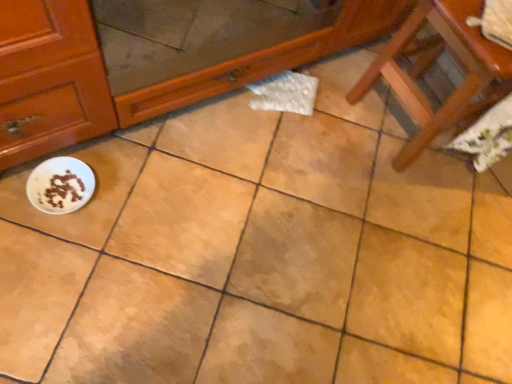
Locate an element on the screen. This screenshot has height=384, width=512. free spot behind white glossy bowl at lower left is located at coordinates (120, 155).